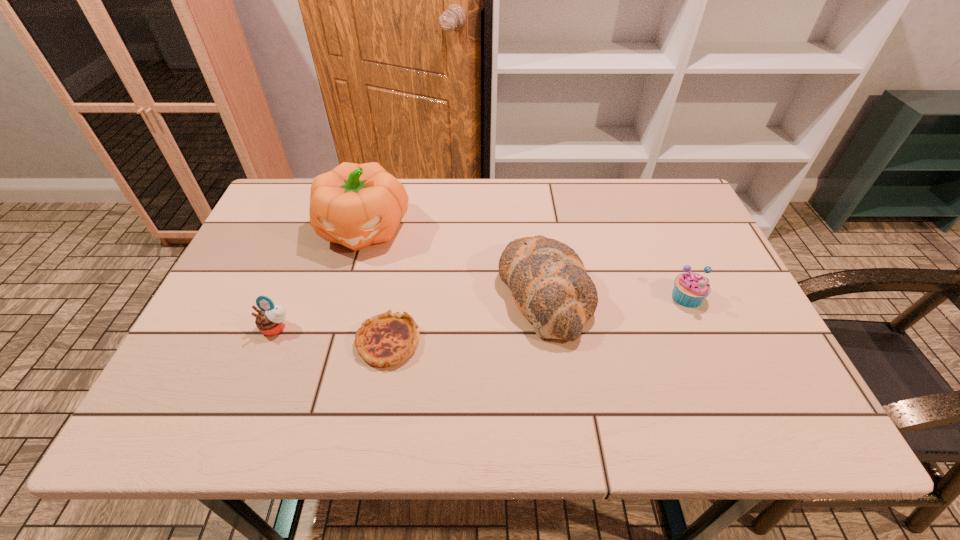
In the image, there is a desktop. Where is `vacant region at the near left corner`? vacant region at the near left corner is located at coordinates (188, 398).

At what (x,y) coordinates should I click in order to perform the action: click on vacant point at the far right corner. Please return your answer as a coordinate pair (x, y). Looking at the image, I should click on (672, 202).

Locate an element on the screen. empty space between the second object from right to left and the right muffin is located at coordinates (615, 294).

At what (x,y) coordinates should I click in order to perform the action: click on vacant space that is in between the tallest object and the left muffin. Please return your answer as a coordinate pair (x, y). Looking at the image, I should click on (320, 279).

Locate an element on the screen. free space between the fourth object from left to right and the left muffin is located at coordinates (410, 310).

Locate an element on the screen. free point between the tallest object and the left muffin is located at coordinates (320, 279).

Where is `free spot between the nearer muffin and the right muffin`? This screenshot has width=960, height=540. free spot between the nearer muffin and the right muffin is located at coordinates (482, 312).

At what (x,y) coordinates should I click in order to perform the action: click on empty space between the bread and the quiche. Please return your answer as a coordinate pair (x, y). Looking at the image, I should click on (467, 317).

Where is `unoccupied area between the tallest object and the shortest object`? This screenshot has height=540, width=960. unoccupied area between the tallest object and the shortest object is located at coordinates (x=375, y=286).

Find the location of `unoccupied position between the left muffin and the quiche`. unoccupied position between the left muffin and the quiche is located at coordinates (332, 335).